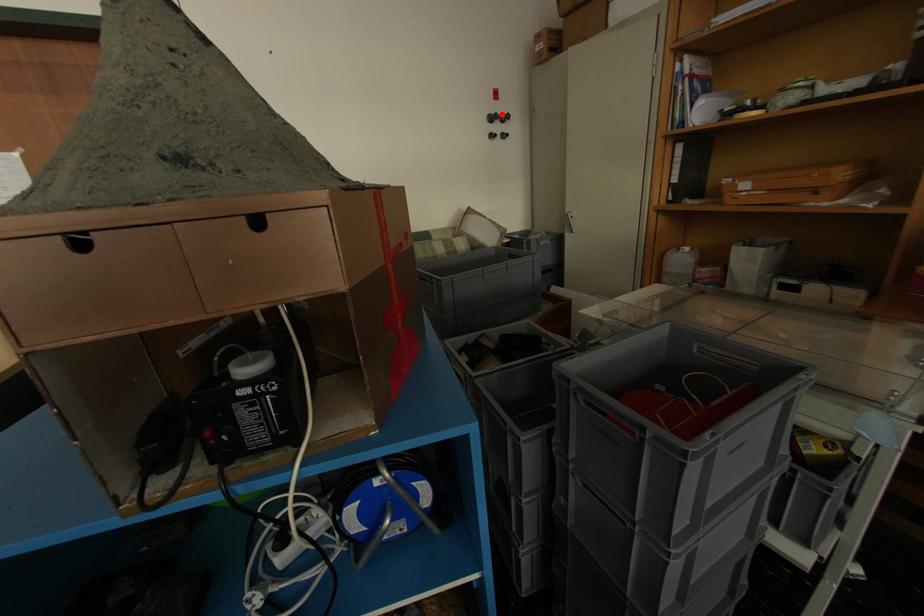
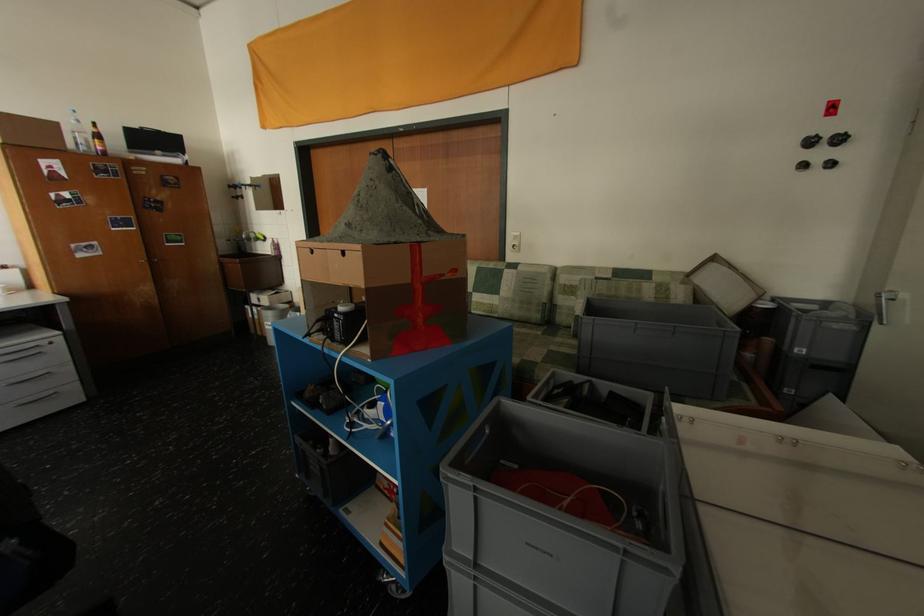
Find the pixel in the second image that matches the highlighted location in the first image.

(821, 137)